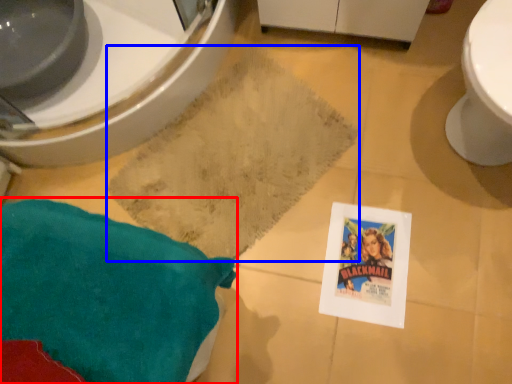
Question: Which point is further to the camera, throw pillow (highlighted by a red box) or bath mat (highlighted by a blue box)?

Choices:
 (A) throw pillow
 (B) bath mat

Answer: (B)